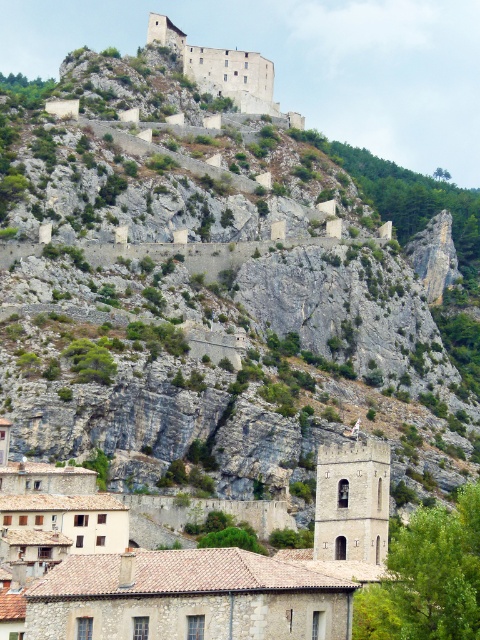
Question: Is stone church at center above brown stone castle at upper center?

Choices:
 (A) yes
 (B) no

Answer: (B)

Question: Is stone church at center to the left of brown stone castle at upper center from the viewer's perspective?

Choices:
 (A) yes
 (B) no

Answer: (A)

Question: Which point is farther to the camera?

Choices:
 (A) (228, 74)
 (B) (74, 630)

Answer: (A)

Question: Can you confirm if stone church at center is thinner than brown stone castle at upper center?

Choices:
 (A) yes
 (B) no

Answer: (B)

Question: Which point is closer to the camera taking this photo?

Choices:
 (A) (130, 636)
 (B) (194, 64)

Answer: (A)